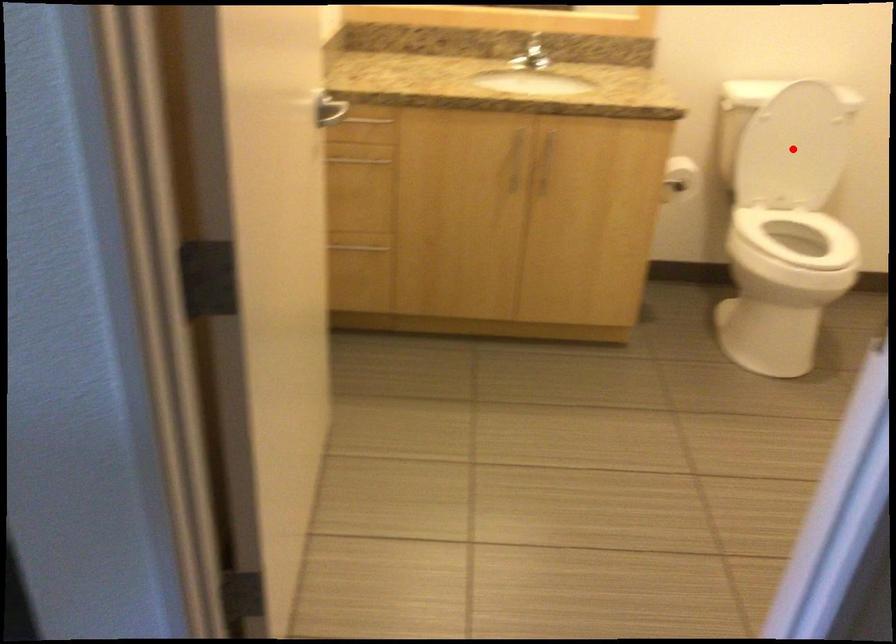
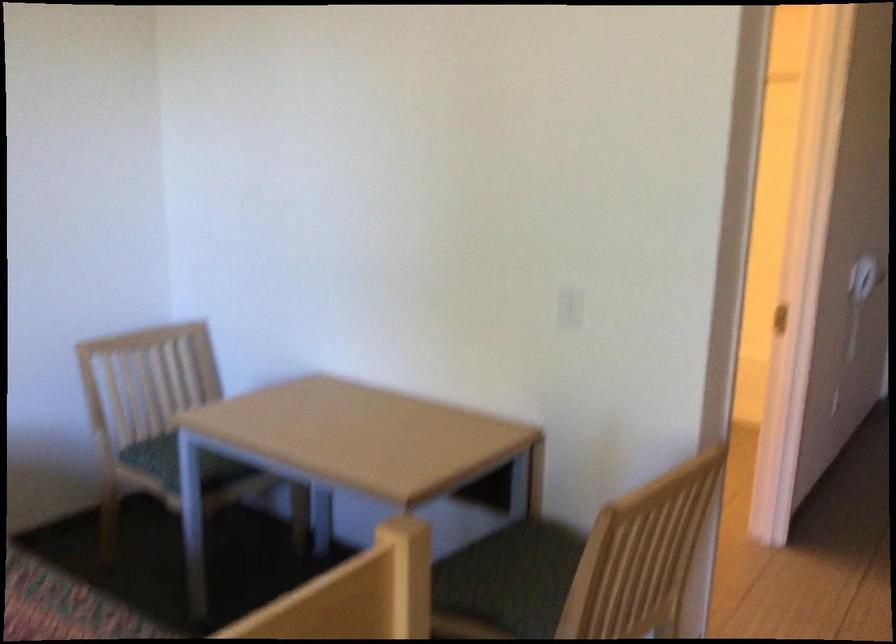
Question: I am providing you with two images of the same scene from different viewpoints. A red point is marked on the first image. Is the red point's position out of view in image 2?

Choices:
 (A) Yes
 (B) No

Answer: (A)